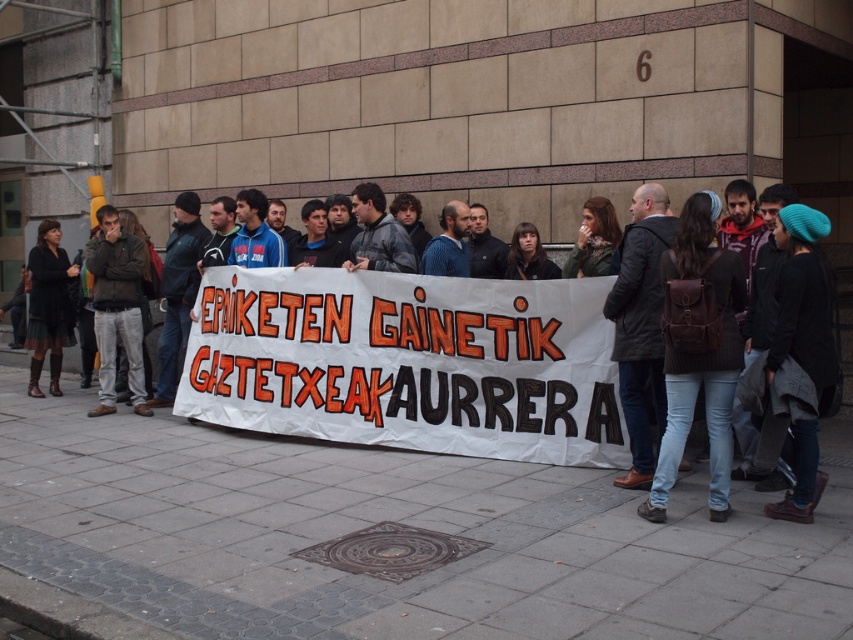
Question: Which object is the closest to the dark brown leather jacket at left?

Choices:
 (A) matte black dress at left
 (B) dark blue knit hat at center

Answer: (A)

Question: Does dark blue knit hat at center appear on the left side of dark brown leather jacket at left?

Choices:
 (A) yes
 (B) no

Answer: (B)

Question: Can you confirm if dark blue knit hat at center is positioned to the right of matte black dress at left?

Choices:
 (A) no
 (B) yes

Answer: (B)

Question: Is dark brown leather jacket at left bigger than matte black dress at left?

Choices:
 (A) yes
 (B) no

Answer: (B)

Question: Which object is farther from the camera taking this photo?

Choices:
 (A) dark brown leather jacket at left
 (B) dark blue knit hat at center

Answer: (A)

Question: Which of the following is the closest to the observer?

Choices:
 (A) (56, 266)
 (B) (120, 269)

Answer: (B)